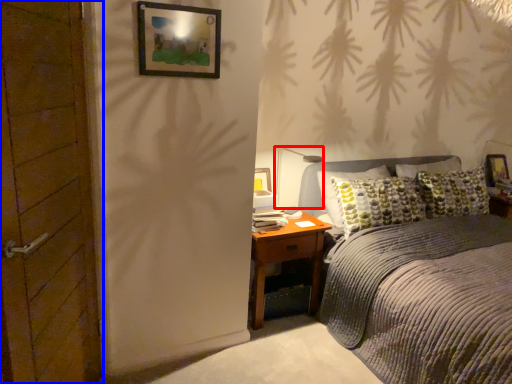
Question: Which object appears closest to the camera in this image, light fixture (highlighted by a red box) or door (highlighted by a blue box)?

Choices:
 (A) light fixture
 (B) door

Answer: (B)